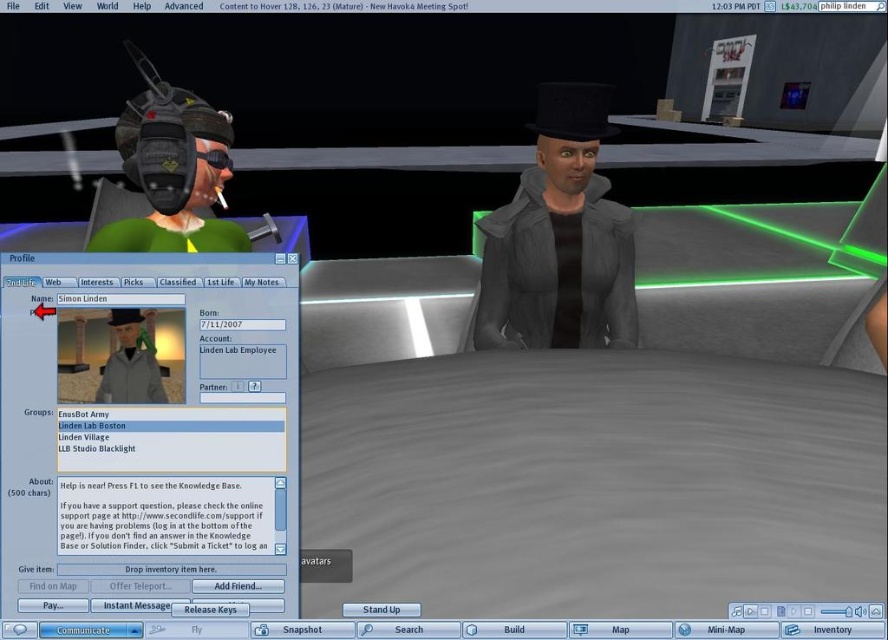
Question: Is matte gray jacket at center to the right of matte black helmet at upper left from the viewer's perspective?

Choices:
 (A) yes
 (B) no

Answer: (A)

Question: Is matte gray profile window at center left below matte black helmet at upper left?

Choices:
 (A) no
 (B) yes

Answer: (B)

Question: Which object is positioned closest to the gray matte jacket at center?

Choices:
 (A) matte gray jacket at center
 (B) matte gray profile window at center left

Answer: (B)

Question: Among these objects, which one is farthest from the camera?

Choices:
 (A) matte gray profile window at center left
 (B) matte black helmet at upper left

Answer: (B)

Question: Is matte gray profile window at center left positioned in front of matte black helmet at upper left?

Choices:
 (A) no
 (B) yes

Answer: (B)

Question: Which object is closer to the camera taking this photo?

Choices:
 (A) matte gray jacket at center
 (B) matte gray profile window at center left
 (C) gray matte jacket at center

Answer: (B)